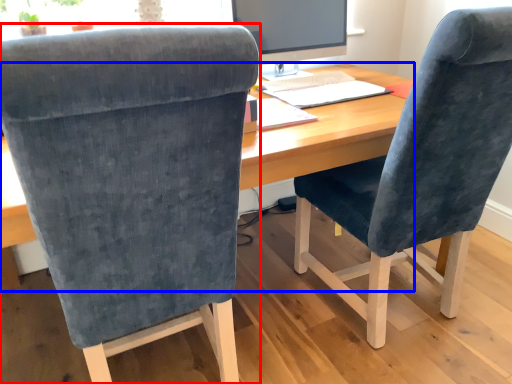
Question: Among these objects, which one is farthest to the camera, chair (highlighted by a red box) or desk (highlighted by a blue box)?

Choices:
 (A) chair
 (B) desk

Answer: (B)